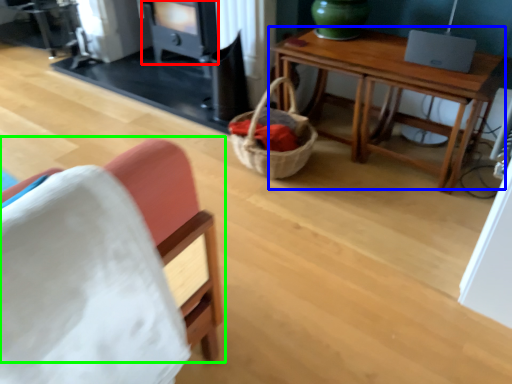
Question: Which is farther away from stove (highlighted by a red box)? table (highlighted by a blue box) or chair (highlighted by a green box)?

Choices:
 (A) table
 (B) chair

Answer: (B)